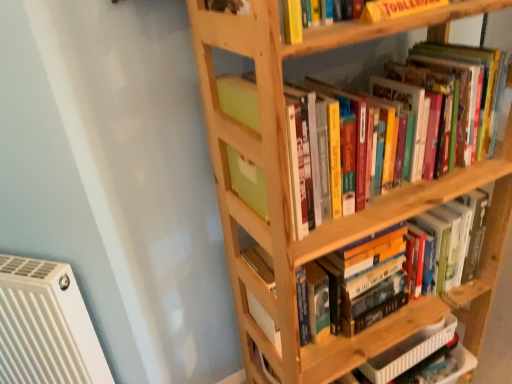
In order to face hardcover book at lower right, the 1th book ordered from the bottom, should I rotate leftwards or rightwards?

To face it directly, rotate right by 19.328 degrees.

The width and height of the screenshot is (512, 384). What do you see at coordinates (331, 220) in the screenshot? I see `natural wood bookshelf at upper right` at bounding box center [331, 220].

The width and height of the screenshot is (512, 384). Identify the location of white plastic radiator at lower left. (46, 326).

This screenshot has width=512, height=384. What do you see at coordinates (448, 240) in the screenshot?
I see `hardcover books at center, the second book viewed from the top` at bounding box center [448, 240].

The width and height of the screenshot is (512, 384). In order to click on hardcover books at center, the second book viewed from the top in this screenshot , I will do `click(448, 240)`.

At what (x,y) coordinates should I click in order to perform the action: click on hardcover book at lower right, the third book from the top. Please return your answer as a coordinate pair (x, y). Looking at the image, I should click on (409, 352).

Could you tell me if hardcover books at center, acting as the 2th book starting from the bottom, is facing white plastic radiator at lower left?

No.

Does point (412, 221) lie behind point (60, 378)?

No.

From the image's perspective, which is below, hardcover books at center, acting as the 2th book starting from the bottom, or white plastic radiator at lower left?

white plastic radiator at lower left appears lower in the image.

There is a white plastic radiator at lower left. Find the location of `the 1st book above it (from a real-world perspective)`. the 1st book above it (from a real-world perspective) is located at coordinates (448, 240).

Is hardcover books at center, acting as the 2th book starting from the bottom, not close to wooden bookshelf at center, which ranks as the third book in bottom-to-top order?

hardcover books at center, acting as the 2th book starting from the bottom, is near wooden bookshelf at center, which ranks as the third book in bottom-to-top order, not far away.

Is the position of hardcover books at center, the second book viewed from the top, less distant than that of wooden bookshelf at center, the 1th book when ordered from top to bottom?

No, hardcover books at center, the second book viewed from the top, is further to the viewer.

Considering the relative positions of hardcover books at center, acting as the 2th book starting from the bottom, and wooden bookshelf at center, the 1th book when ordered from top to bottom, in the image provided, is hardcover books at center, acting as the 2th book starting from the bottom, to the left or to the right of wooden bookshelf at center, the 1th book when ordered from top to bottom,?

hardcover books at center, acting as the 2th book starting from the bottom, is positioned on wooden bookshelf at center, the 1th book when ordered from top to bottom,'s right side.

From a real-world perspective, between hardcover books at center, acting as the 2th book starting from the bottom, and wooden bookshelf at center, which ranks as the third book in bottom-to-top order, who is vertically lower?

hardcover books at center, acting as the 2th book starting from the bottom.

Between white plastic radiator at lower left and natural wood bookshelf at upper right, which one has less height?

Standing shorter between the two is white plastic radiator at lower left.

Does white plastic radiator at lower left touch natural wood bookshelf at upper right?

They are not placed beside each other.

Is white plastic radiator at lower left positioned with its back to natural wood bookshelf at upper right?

That's not correct — white plastic radiator at lower left is not looking away from natural wood bookshelf at upper right.

Is white plastic radiator at lower left surrounding wooden bookshelf at center, the 1th book when ordered from top to bottom?

No, wooden bookshelf at center, the 1th book when ordered from top to bottom, is not inside white plastic radiator at lower left.

Is white plastic radiator at lower left wider or thinner than wooden bookshelf at center, which ranks as the third book in bottom-to-top order?

In the image, white plastic radiator at lower left appears to be more narrow than wooden bookshelf at center, which ranks as the third book in bottom-to-top order.

Considering the sizes of white plastic radiator at lower left and wooden bookshelf at center, the 1th book when ordered from top to bottom, in the image, is white plastic radiator at lower left taller or shorter than wooden bookshelf at center, the 1th book when ordered from top to bottom,?

Considering their sizes, white plastic radiator at lower left has more height than wooden bookshelf at center, the 1th book when ordered from top to bottom.

Is the surface of white plastic radiator at lower left in direct contact with wooden bookshelf at center, which ranks as the third book in bottom-to-top order?

No.

Considering the positions of point (253, 181) and point (364, 11), is point (253, 181) closer or farther from the camera than point (364, 11)?

Point (253, 181) is positioned farther from the camera compared to point (364, 11).

Can you confirm if wooden bookshelf at center, the 1th book when ordered from top to bottom, is smaller than yellow cardboard toblerone at upper center?

Incorrect, wooden bookshelf at center, the 1th book when ordered from top to bottom, is not smaller in size than yellow cardboard toblerone at upper center.

From a real-world perspective, is wooden bookshelf at center, which ranks as the third book in bottom-to-top order, above or below yellow cardboard toblerone at upper center?

wooden bookshelf at center, which ranks as the third book in bottom-to-top order, is below yellow cardboard toblerone at upper center.

Which of these two, hardcover book at lower right, the third book from the top, or yellow cardboard toblerone at upper center, is wider?

hardcover book at lower right, the third book from the top, is wider.

Is hardcover book at lower right, the 1th book ordered from the bottom, positioned with its back to yellow cardboard toblerone at upper center?

hardcover book at lower right, the 1th book ordered from the bottom, does not have its back to yellow cardboard toblerone at upper center.

There is a yellow cardboard toblerone at upper center. Where is `the 3rd book below it (from the image's perspective)`? This screenshot has height=384, width=512. the 3rd book below it (from the image's perspective) is located at coordinates (409, 352).

Considering the points (401, 362) and (423, 3), which point is in front, point (401, 362) or point (423, 3)?

Point (423, 3)

Is natural wood bookshelf at upper right looking in the opposite direction of hardcover book at lower right, the third book from the top?

That's right, natural wood bookshelf at upper right is facing away from hardcover book at lower right, the third book from the top.

How many degrees apart are the facing directions of natural wood bookshelf at upper right and hardcover book at lower right, the 1th book ordered from the bottom?

0.805 degrees.

Is natural wood bookshelf at upper right behind hardcover book at lower right, the 1th book ordered from the bottom?

No, natural wood bookshelf at upper right is in front of hardcover book at lower right, the 1th book ordered from the bottom.

Where is `the 1st book above the white plastic radiator at lower left (from a real-world perspective)`? Image resolution: width=512 pixels, height=384 pixels. the 1st book above the white plastic radiator at lower left (from a real-world perspective) is located at coordinates (448, 240).

This screenshot has height=384, width=512. In order to click on the 1st book counting from the right of the wooden bookshelf at center, the 1th book when ordered from top to bottom in this screenshot , I will do `click(448, 240)`.

Which object lies nearer to the anchor point white plastic radiator at lower left, hardcover books at center, acting as the 2th book starting from the bottom, or hardcover book at lower right, the third book from the top?

The object closer to white plastic radiator at lower left is hardcover books at center, acting as the 2th book starting from the bottom.

Considering their positions, is natural wood bookshelf at upper right positioned closer to yellow cardboard toblerone at upper center than white plastic radiator at lower left?

natural wood bookshelf at upper right is positioned closer to the anchor yellow cardboard toblerone at upper center.

When comparing their distances from hardcover books at center, the second book viewed from the top, does hardcover book at lower right, the third book from the top, or wooden bookshelf at center, the 1th book when ordered from top to bottom, seem further?

Based on the image, wooden bookshelf at center, the 1th book when ordered from top to bottom, appears to be further to hardcover books at center, the second book viewed from the top.

Considering their positions, is hardcover books at center, acting as the 2th book starting from the bottom, positioned closer to yellow cardboard toblerone at upper center than wooden bookshelf at center, which ranks as the third book in bottom-to-top order?

Based on the image, wooden bookshelf at center, which ranks as the third book in bottom-to-top order, appears to be nearer to yellow cardboard toblerone at upper center.

When comparing their distances from wooden bookshelf at center, the 1th book when ordered from top to bottom, does yellow cardboard toblerone at upper center or hardcover book at lower right, the third book from the top, seem further?

hardcover book at lower right, the third book from the top, is further to wooden bookshelf at center, the 1th book when ordered from top to bottom.

Based on their spatial positions, is hardcover books at center, the second book viewed from the top, or yellow cardboard toblerone at upper center closer to hardcover book at lower right, the third book from the top?

hardcover books at center, the second book viewed from the top, lies closer to hardcover book at lower right, the third book from the top, than the other object.

From the image, which object appears to be farther from hardcover books at center, acting as the 2th book starting from the bottom, wooden bookshelf at center, the 1th book when ordered from top to bottom, or natural wood bookshelf at upper right?

wooden bookshelf at center, the 1th book when ordered from top to bottom, is further to hardcover books at center, acting as the 2th book starting from the bottom.

Considering their positions, is white plastic radiator at lower left positioned closer to natural wood bookshelf at upper right than hardcover book at lower right, the third book from the top?

hardcover book at lower right, the third book from the top, is closer to natural wood bookshelf at upper right.

This screenshot has height=384, width=512. What are the coordinates of `paperback book located between white plastic radiator at lower left and hardcover books at center, the second book viewed from the top, in the left-right direction` in the screenshot? It's located at (396, 9).

You are a GUI agent. You are given a task and a screenshot of the screen. Output one action in this format:
    pyautogui.click(x=<x>, y=<y>)
    Task: Click on the shelf between white plastic radiator at lower left and hardcover books at center, acting as the 2th book starting from the bottom
    The height and width of the screenshot is (384, 512).
    Given the screenshot: What is the action you would take?
    pyautogui.click(x=331, y=220)

The image size is (512, 384). Find the location of `book that lies between yellow cardboard toblerone at upper center and natural wood bookshelf at upper right from top to bottom`. book that lies between yellow cardboard toblerone at upper center and natural wood bookshelf at upper right from top to bottom is located at coordinates point(239,100).

Image resolution: width=512 pixels, height=384 pixels. I want to click on shelf between yellow cardboard toblerone at upper center and hardcover books at center, acting as the 2th book starting from the bottom, vertically, so click(x=331, y=220).